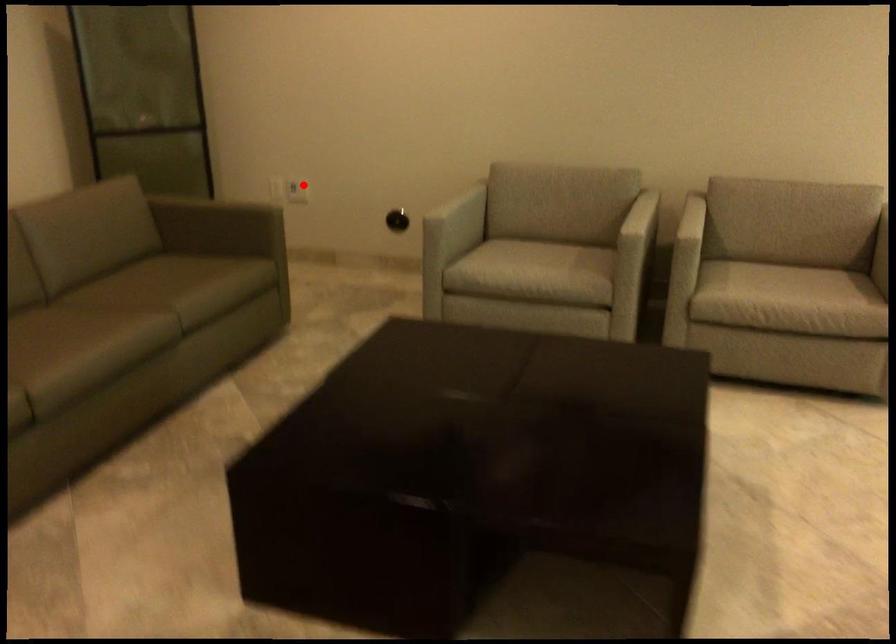
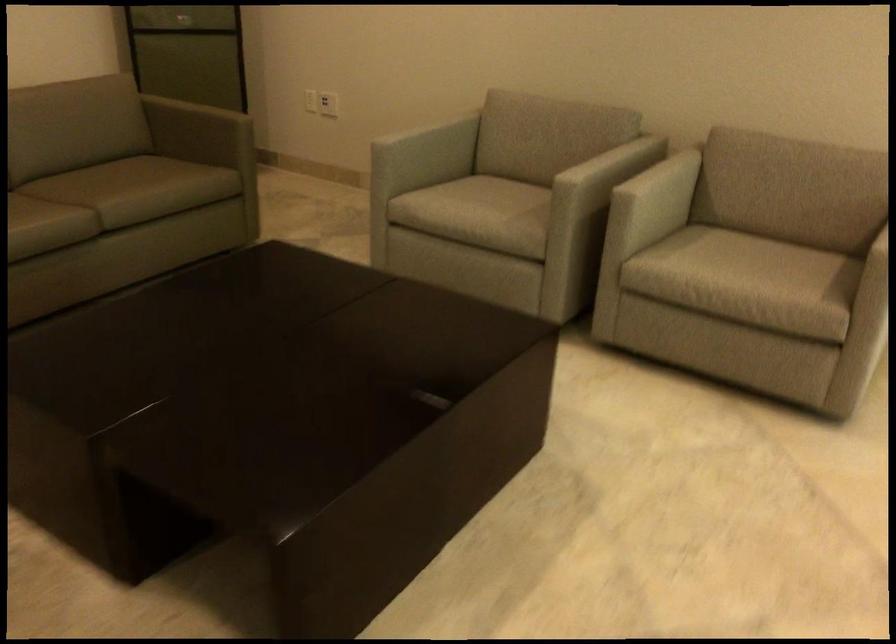
Find the pixel in the second image that matches the highlighted location in the first image.

(328, 104)